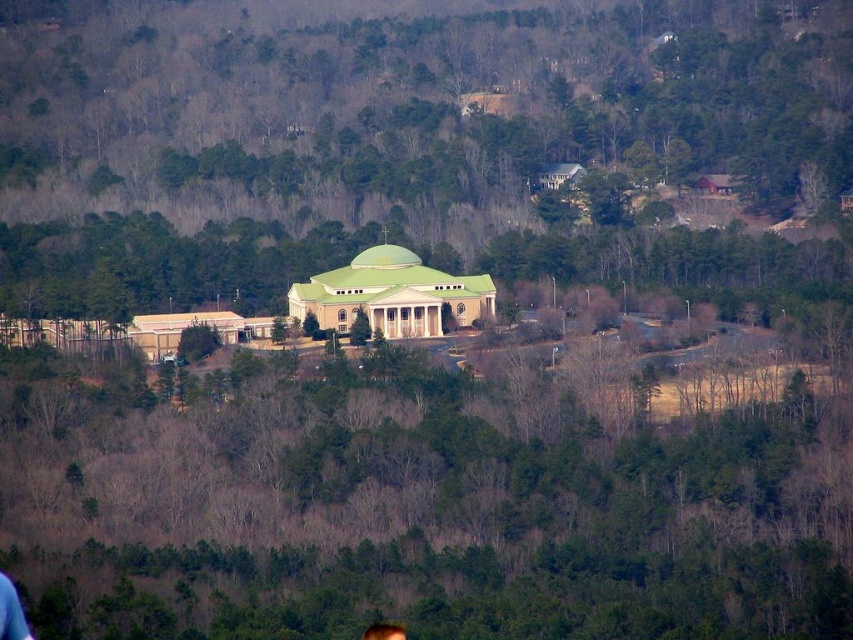
Locate an element on the screen. This screenshot has width=853, height=640. green dome building at center is located at coordinates (415, 145).

Is point (317, 106) positioned in front of point (380, 627)?

That is False.

Who is more forward, (595, 273) or (392, 627)?

Point (392, 627) is more forward.

Where is `green dome building at center`? The height and width of the screenshot is (640, 853). green dome building at center is located at coordinates (415, 145).

Is the position of green dome building at center less distant than that of green leafy tree at center?

No, it is behind green leafy tree at center.

Who is higher up, green dome building at center or green leafy tree at center?

green dome building at center is above.

Which is in front, point (799, 102) or point (534, 404)?

Point (534, 404) is in front.

What are the coordinates of `green dome building at center` in the screenshot? It's located at (x=415, y=145).

Between green leafy tree at center and blonde hair at center, which one appears on the right side from the viewer's perspective?

From the viewer's perspective, green leafy tree at center appears more on the right side.

Can you confirm if green leafy tree at center is shorter than blonde hair at center?

No, green leafy tree at center is not shorter than blonde hair at center.

Identify the location of green leafy tree at center. The height and width of the screenshot is (640, 853). (428, 497).